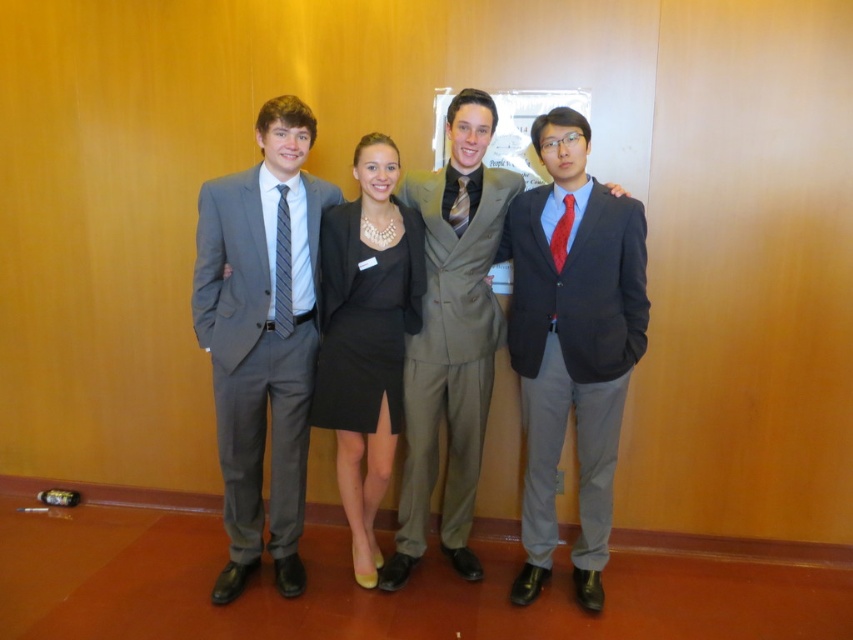
Question: Where is satin gray suit at center located in relation to yellow striped tie at center in the image?

Choices:
 (A) below
 (B) above

Answer: (A)

Question: Considering the real-world distances, which object is closest to the red satin tie at right?

Choices:
 (A) striped silk tie at center
 (B) yellow striped tie at center
 (C) matte black suit at right

Answer: (B)

Question: Is striped silk tie at center below yellow striped tie at center?

Choices:
 (A) yes
 (B) no

Answer: (A)

Question: Which point is closer to the camera?

Choices:
 (A) (625, 248)
 (B) (277, 225)
 (C) (473, 216)
 (D) (465, 202)

Answer: (A)

Question: Is matte gray suit at left bigger than red satin tie at right?

Choices:
 (A) yes
 (B) no

Answer: (A)

Question: Which of the following is the closest to the observer?

Choices:
 (A) matte gray suit at center
 (B) matte black suit at right
 (C) red satin tie at right
 (D) matte gray suit at left

Answer: (D)